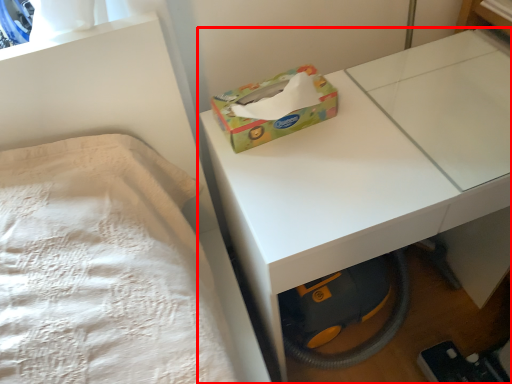
Question: In this image, where is table (annotated by the red box) located relative to box?

Choices:
 (A) left
 (B) right

Answer: (B)